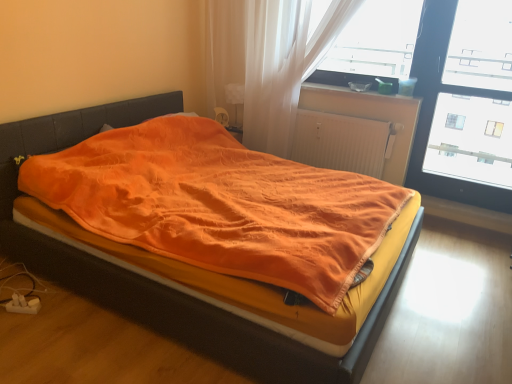
Question: Does matte plastic container at upper right lie in front of transparent plastic window screen at upper right, which ranks as the 2th window screen in right-to-left order?

Choices:
 (A) yes
 (B) no

Answer: (B)

Question: Is matte plastic container at upper right next to transparent plastic window screen at upper right, which ranks as the 2th window screen in right-to-left order?

Choices:
 (A) no
 (B) yes

Answer: (A)

Question: Is matte plastic container at upper right positioned with its back to transparent plastic window screen at upper right, which ranks as the 2th window screen in right-to-left order?

Choices:
 (A) yes
 (B) no

Answer: (B)

Question: Is matte plastic container at upper right not inside transparent plastic window screen at upper right, which is the 1th window screen in left-to-right order?

Choices:
 (A) yes
 (B) no

Answer: (A)

Question: From a real-world perspective, is matte plastic container at upper right located higher than transparent plastic window screen at upper right, which is the 1th window screen in left-to-right order?

Choices:
 (A) no
 (B) yes

Answer: (A)

Question: Is matte plastic container at upper right bigger or smaller than translucent fabric curtain at upper center?

Choices:
 (A) small
 (B) big

Answer: (A)

Question: Which is correct: matte plastic container at upper right is inside translucent fabric curtain at upper center, or outside of it?

Choices:
 (A) inside
 (B) outside

Answer: (B)

Question: From their relative heights in the image, would you say matte plastic container at upper right is taller or shorter than translucent fabric curtain at upper center?

Choices:
 (A) tall
 (B) short

Answer: (B)

Question: In the image, is matte plastic container at upper right positioned in front of or behind translucent fabric curtain at upper center?

Choices:
 (A) behind
 (B) front

Answer: (A)

Question: From a real-world perspective, is matte plastic container at upper right above or below transparent plastic window screen at upper right, which is the 1th window screen in left-to-right order?

Choices:
 (A) above
 (B) below

Answer: (B)

Question: In terms of size, does matte plastic container at upper right appear bigger or smaller than transparent plastic window screen at upper right, which ranks as the 2th window screen in right-to-left order?

Choices:
 (A) small
 (B) big

Answer: (A)

Question: From the image's perspective, is matte plastic container at upper right located above or below transparent plastic window screen at upper right, which is the 1th window screen in left-to-right order?

Choices:
 (A) below
 (B) above

Answer: (A)

Question: Visually, is matte plastic container at upper right positioned to the left or to the right of transparent plastic window screen at upper right, which ranks as the 2th window screen in right-to-left order?

Choices:
 (A) right
 (B) left

Answer: (B)

Question: Is transparent plastic window screen at upper right, which ranks as the 2th window screen in right-to-left order, inside the boundaries of transparent glass window at upper right, which is counted as the second window screen, starting from the left, or outside?

Choices:
 (A) inside
 (B) outside

Answer: (B)

Question: From a real-world perspective, relative to transparent glass window at upper right, which is counted as the second window screen, starting from the left, is transparent plastic window screen at upper right, which ranks as the 2th window screen in right-to-left order, vertically above or below?

Choices:
 (A) below
 (B) above

Answer: (B)